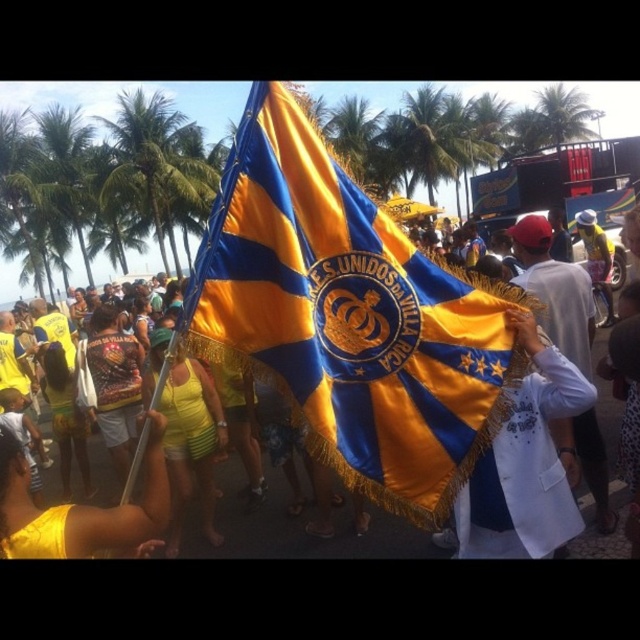
Does satin yellow-blue flag at center appear on the right side of white cotton shirt at center?

In fact, satin yellow-blue flag at center is to the left of white cotton shirt at center.

Is satin yellow-blue flag at center taller than white cotton shirt at center?

No, satin yellow-blue flag at center is not taller than white cotton shirt at center.

The image size is (640, 640). What do you see at coordinates (346, 317) in the screenshot?
I see `satin yellow-blue flag at center` at bounding box center [346, 317].

This screenshot has width=640, height=640. I want to click on satin yellow-blue flag at center, so point(346,317).

At what (x,y) coordinates should I click in order to perform the action: click on green leafy palm tree at upper left. Please return your answer as a coordinate pair (x, y). The image size is (640, 640). Looking at the image, I should click on (157, 168).

Looking at this image, does green leafy palm tree at upper left come behind white cotton shirt at center?

Yes, green leafy palm tree at upper left is behind white cotton shirt at center.

The height and width of the screenshot is (640, 640). What are the coordinates of `green leafy palm tree at upper left` in the screenshot? It's located at (157, 168).

Where is `green leafy palm tree at upper left`? This screenshot has height=640, width=640. green leafy palm tree at upper left is located at coordinates (157, 168).

Can you confirm if satin yellow-blue flag at center is bigger than green leafy palm tree at upper left?

No, satin yellow-blue flag at center is not bigger than green leafy palm tree at upper left.

Can you confirm if satin yellow-blue flag at center is positioned to the left of green leafy palm tree at upper left?

No, satin yellow-blue flag at center is not to the left of green leafy palm tree at upper left.

Is point (266, 371) positioned behind point (108, 120)?

No, it is in front of (108, 120).

Where is `satin yellow-blue flag at center`? satin yellow-blue flag at center is located at coordinates (346, 317).